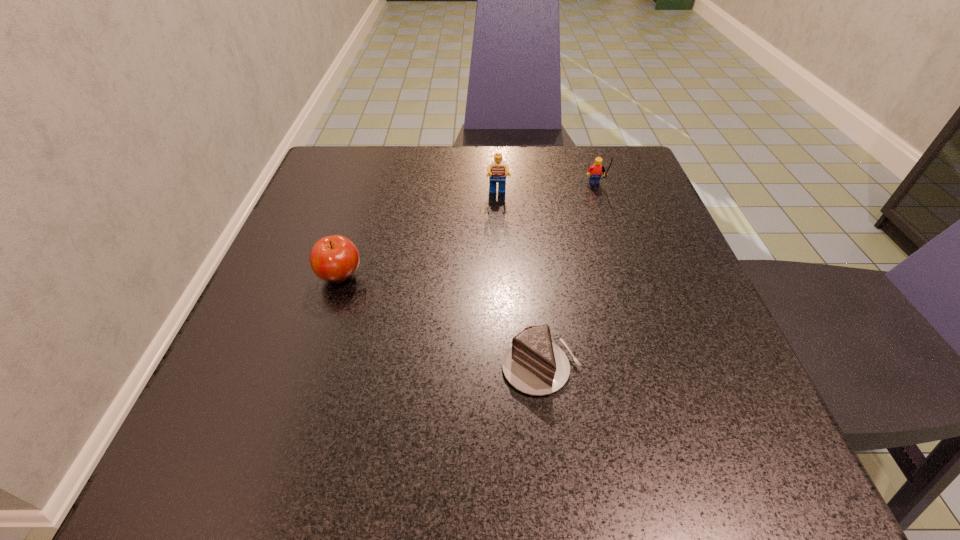
What are the coordinates of `vacant space that's between the right Lego and the left Lego` in the screenshot? It's located at (546, 191).

Identify the location of vacant area that lies between the left Lego and the shortest object. The width and height of the screenshot is (960, 540). (519, 281).

Locate an element on the screen. This screenshot has width=960, height=540. empty location between the leftmost object and the rightmost object is located at coordinates (468, 232).

I want to click on empty space between the right Lego and the chocolate cake, so click(568, 278).

I want to click on empty space that is in between the right Lego and the leftmost object, so click(x=468, y=232).

Locate an element on the screen. The width and height of the screenshot is (960, 540). vacant area that lies between the right Lego and the chocolate cake is located at coordinates (568, 278).

Where is `free spot between the apple and the right Lego`? free spot between the apple and the right Lego is located at coordinates point(468,232).

The image size is (960, 540). I want to click on vacant area between the left Lego and the second nearest object, so click(x=419, y=235).

Locate an element on the screen. free space between the shortest object and the apple is located at coordinates (441, 322).

At what (x,y) coordinates should I click in order to perform the action: click on object that is the second closest to the right Lego. Please return your answer as a coordinate pair (x, y). This screenshot has height=540, width=960. Looking at the image, I should click on (533, 364).